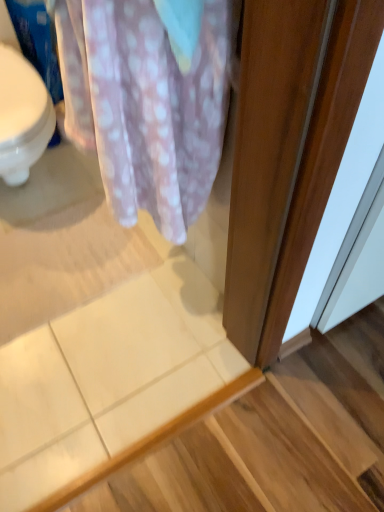
The image size is (384, 512). I want to click on pink polka dot fabric at upper left, so click(145, 106).

This screenshot has width=384, height=512. Describe the element at coordinates (145, 106) in the screenshot. I see `pink polka dot fabric at upper left` at that location.

The height and width of the screenshot is (512, 384). In order to click on white tile at lower left in this screenshot , I will do `click(277, 439)`.

The width and height of the screenshot is (384, 512). What do you see at coordinates (277, 439) in the screenshot? I see `white tile at lower left` at bounding box center [277, 439].

Where is `pink polka dot fabric at upper left`? pink polka dot fabric at upper left is located at coordinates (145, 106).

Which object is positioned more to the right, white tile at lower left or pink polka dot fabric at upper left?

From the viewer's perspective, white tile at lower left appears more on the right side.

Relative to pink polka dot fabric at upper left, is white tile at lower left in front or behind?

white tile at lower left is positioned farther from the viewer than pink polka dot fabric at upper left.

Does point (339, 343) come behind point (159, 22)?

Yes.

From the image's perspective, is white tile at lower left below pink polka dot fabric at upper left?

Indeed, from the image's perspective, white tile at lower left is shown beneath pink polka dot fabric at upper left.

From a real-world perspective, is white tile at lower left positioned above or below pink polka dot fabric at upper left?

From a real-world perspective, white tile at lower left is physically below pink polka dot fabric at upper left.

Which object is thinner, white tile at lower left or pink polka dot fabric at upper left?

With smaller width is pink polka dot fabric at upper left.

Considering the relative sizes of white tile at lower left and pink polka dot fabric at upper left in the image provided, is white tile at lower left shorter than pink polka dot fabric at upper left?

Indeed, white tile at lower left has a lesser height compared to pink polka dot fabric at upper left.

Is white tile at lower left bigger or smaller than pink polka dot fabric at upper left?

In the image, white tile at lower left appears to be smaller than pink polka dot fabric at upper left.

Based on the photo, is pink polka dot fabric at upper left completely or partially inside white tile at lower left?

That's incorrect, pink polka dot fabric at upper left is not inside white tile at lower left.

Is white tile at lower left in contact with pink polka dot fabric at upper left?

There is a gap between white tile at lower left and pink polka dot fabric at upper left.

Is white tile at lower left facing towards pink polka dot fabric at upper left?

No, white tile at lower left is not facing towards pink polka dot fabric at upper left.

What's the angular difference between white tile at lower left and pink polka dot fabric at upper left's facing directions?

The facing directions of white tile at lower left and pink polka dot fabric at upper left are 89.1 degrees apart.

Measure the distance from white tile at lower left to pink polka dot fabric at upper left.

A distance of 26.60 inches exists between white tile at lower left and pink polka dot fabric at upper left.

Locate an element on the screen. The image size is (384, 512). stair lying below the pink polka dot fabric at upper left (from the image's perspective) is located at coordinates (277, 439).

Between pink polka dot fabric at upper left and white tile at lower left, which one appears on the left side from the viewer's perspective?

Positioned to the left is pink polka dot fabric at upper left.

In the image, is pink polka dot fabric at upper left positioned in front of or behind white tile at lower left?

Clearly, pink polka dot fabric at upper left is in front of white tile at lower left.

Is point (94, 145) farther from camera compared to point (188, 444)?

No, (94, 145) is closer to viewer.

From the image's perspective, does pink polka dot fabric at upper left appear lower than white tile at lower left?

Incorrect, from the image's perspective, pink polka dot fabric at upper left is higher than white tile at lower left.

From a real-world perspective, does pink polka dot fabric at upper left sit lower than white tile at lower left?

No, from a real-world perspective, pink polka dot fabric at upper left is not beneath white tile at lower left.

Can you confirm if pink polka dot fabric at upper left is thinner than white tile at lower left?

Indeed, pink polka dot fabric at upper left has a lesser width compared to white tile at lower left.

Consider the image. Can you confirm if pink polka dot fabric at upper left is taller than white tile at lower left?

Yes.

Does pink polka dot fabric at upper left have a smaller size compared to white tile at lower left?

Incorrect, pink polka dot fabric at upper left is not smaller in size than white tile at lower left.

Is white tile at lower left a part of pink polka dot fabric at upper left?

Definitely not — white tile at lower left is not inside pink polka dot fabric at upper left.

Is there a large distance between pink polka dot fabric at upper left and white tile at lower left?

pink polka dot fabric at upper left is actually quite close to white tile at lower left.

Could you tell me if pink polka dot fabric at upper left is turned towards white tile at lower left?

No, pink polka dot fabric at upper left is not oriented towards white tile at lower left.

How many degrees apart are the facing directions of pink polka dot fabric at upper left and white tile at lower left?

89.1 degrees.

Locate an element on the screen. stair below the pink polka dot fabric at upper left (from the image's perspective) is located at coordinates (277, 439).

The height and width of the screenshot is (512, 384). Find the location of `blanket above the white tile at lower left (from the image's perspective)`. blanket above the white tile at lower left (from the image's perspective) is located at coordinates (145, 106).

The height and width of the screenshot is (512, 384). In order to click on stair that is on the right side of pink polka dot fabric at upper left in this screenshot , I will do `click(277, 439)`.